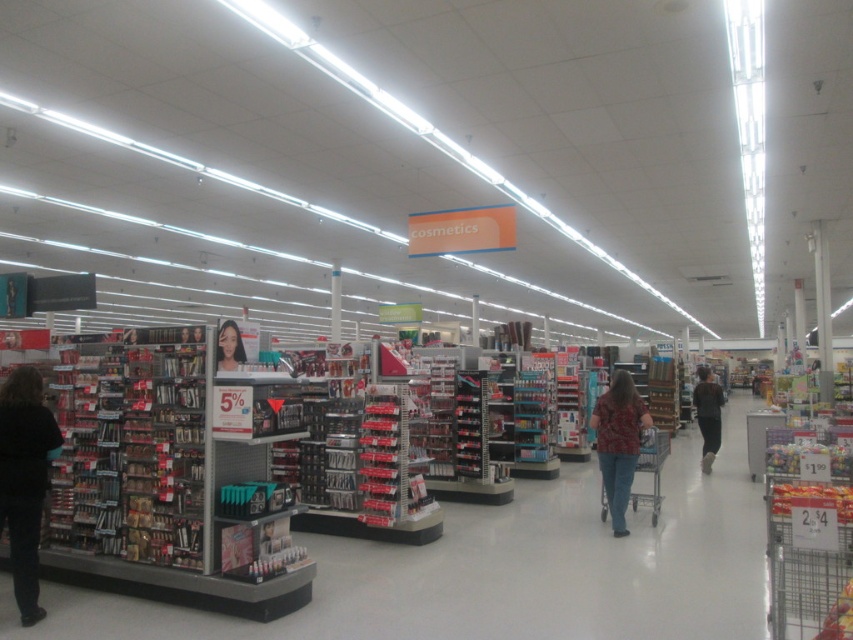
Question: Estimate the real-world distances between objects in this image. Which object is closer to the floral shirt at center?

Choices:
 (A) smooth brown hair at center
 (B) brown fuzzy sweater at center

Answer: (A)

Question: Which of the following is the closest to the observer?

Choices:
 (A) (49, 410)
 (B) (639, 438)
 (C) (714, 381)
 (D) (221, 332)

Answer: (D)

Question: Is dark brown hair at left thinner than smooth brown hair at center?

Choices:
 (A) yes
 (B) no

Answer: (B)

Question: Does brown fuzzy sweater at center have a lesser width compared to smooth brown hair at center?

Choices:
 (A) yes
 (B) no

Answer: (B)

Question: Which point is farther to the camera?

Choices:
 (A) pos(618,509)
 (B) pos(222,324)
 (C) pos(714,390)
 (D) pos(9,464)

Answer: (C)

Question: Does floral shirt at center appear on the right side of brown fuzzy sweater at center?

Choices:
 (A) no
 (B) yes

Answer: (A)